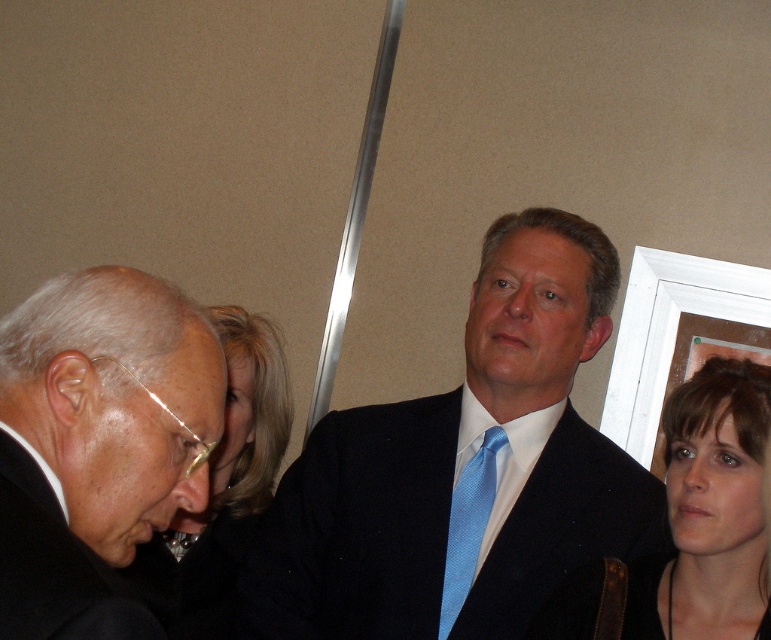
Does matte black suit at center have a smaller size compared to white wooden picture frame at upper right?

No, matte black suit at center is not smaller than white wooden picture frame at upper right.

Between point (423, 573) and point (668, 364), which one is positioned behind?

Point (668, 364)

Which is in front, point (554, 467) or point (674, 298)?

Positioned in front is point (554, 467).

I want to click on matte black suit at center, so click(x=463, y=468).

Which is above, matte black suit at left or white wooden picture frame at upper right?

white wooden picture frame at upper right is above.

The image size is (771, 640). What do you see at coordinates (96, 444) in the screenshot?
I see `matte black suit at left` at bounding box center [96, 444].

Is point (29, 612) in front of point (651, 310)?

Yes.

The height and width of the screenshot is (640, 771). Identify the location of matte black suit at left. (96, 444).

Is black matte suit at lower left to the left of white wooden picture frame at upper right from the viewer's perspective?

Yes, black matte suit at lower left is to the left of white wooden picture frame at upper right.

Looking at this image, between black matte suit at lower left and white wooden picture frame at upper right, which one appears on the right side from the viewer's perspective?

Positioned to the right is white wooden picture frame at upper right.

Is point (49, 582) farther from camera compared to point (739, 273)?

No, (49, 582) is closer to viewer.

Locate an element on the screen. black matte suit at lower left is located at coordinates point(54,564).